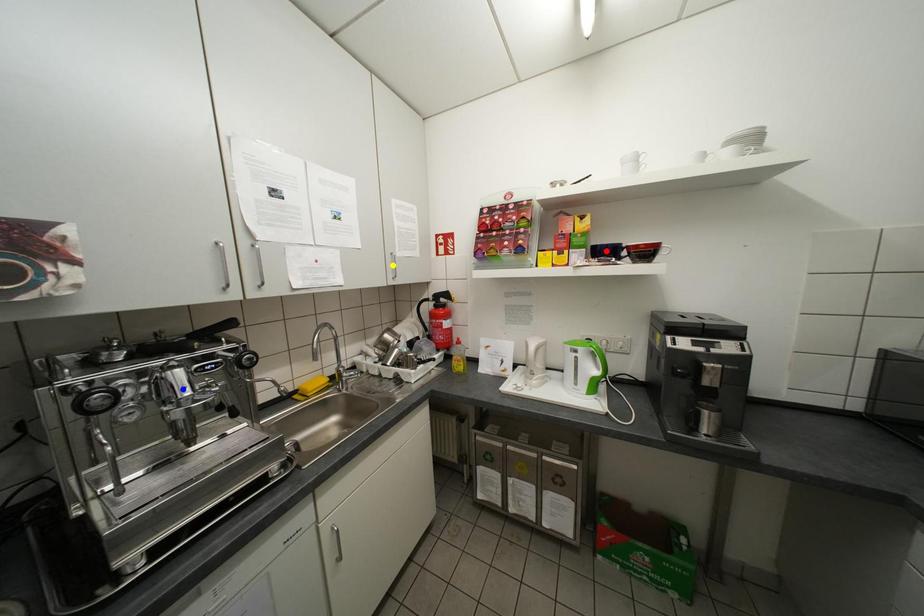
Order these from farthest to nearest:
A) red point
B) yellow point
C) blue point

yellow point → red point → blue point